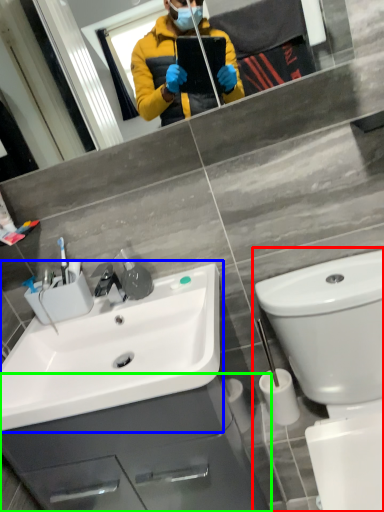
Question: Which is nearer to the toilet (highlighted by a red box)? sink (highlighted by a blue box) or bathroom cabinet (highlighted by a green box).

Choices:
 (A) sink
 (B) bathroom cabinet

Answer: (A)